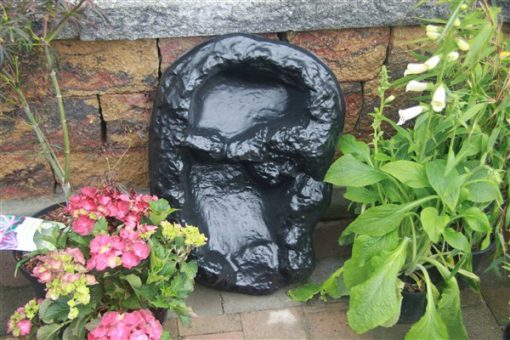
Identify the location of vase. The image size is (510, 340). (480, 258), (32, 278).